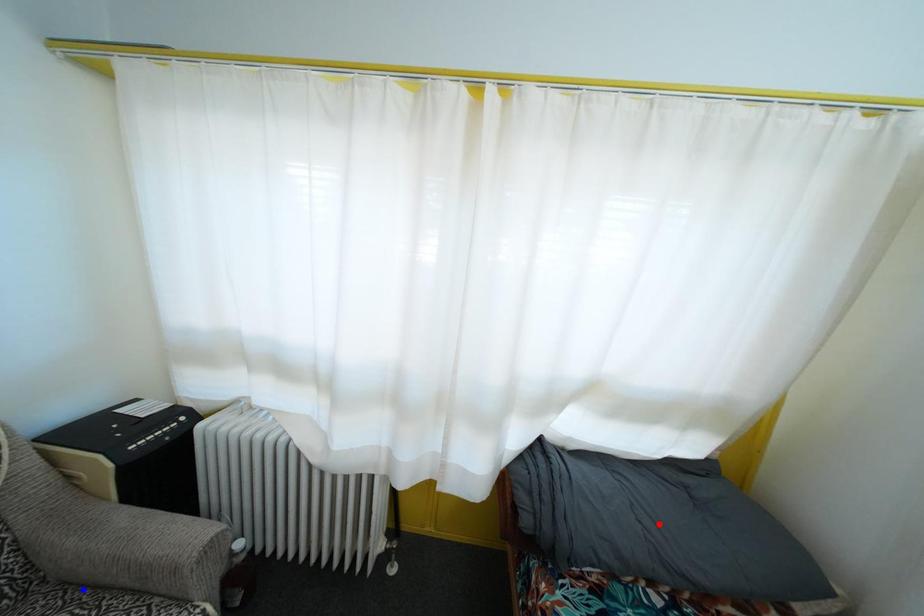
Question: Two points are marked on the image. Which point is closer to the camera?

Choices:
 (A) Blue point is closer.
 (B) Red point is closer.

Answer: (A)